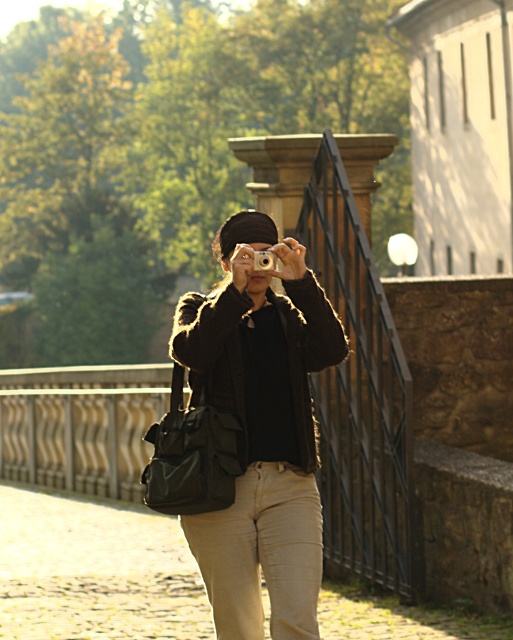
Question: Which is farther from the silver metallic camera at center?

Choices:
 (A) matte black camera at center
 (B) khaki cotton pants at center

Answer: (B)

Question: Considering the real-world distances, which object is closest to the silver metallic camera at center?

Choices:
 (A) matte black camera at center
 (B) khaki cotton pants at center

Answer: (A)

Question: Is matte black camera at center positioned behind silver metallic camera at center?

Choices:
 (A) yes
 (B) no

Answer: (B)

Question: Considering the real-world distances, which object is farthest from the khaki cotton pants at center?

Choices:
 (A) matte black camera at center
 (B) silver metallic camera at center

Answer: (B)

Question: In this image, where is khaki cotton pants at center located relative to silver metallic camera at center?

Choices:
 (A) above
 (B) below

Answer: (B)

Question: Is matte black camera at center above khaki cotton pants at center?

Choices:
 (A) yes
 (B) no

Answer: (A)